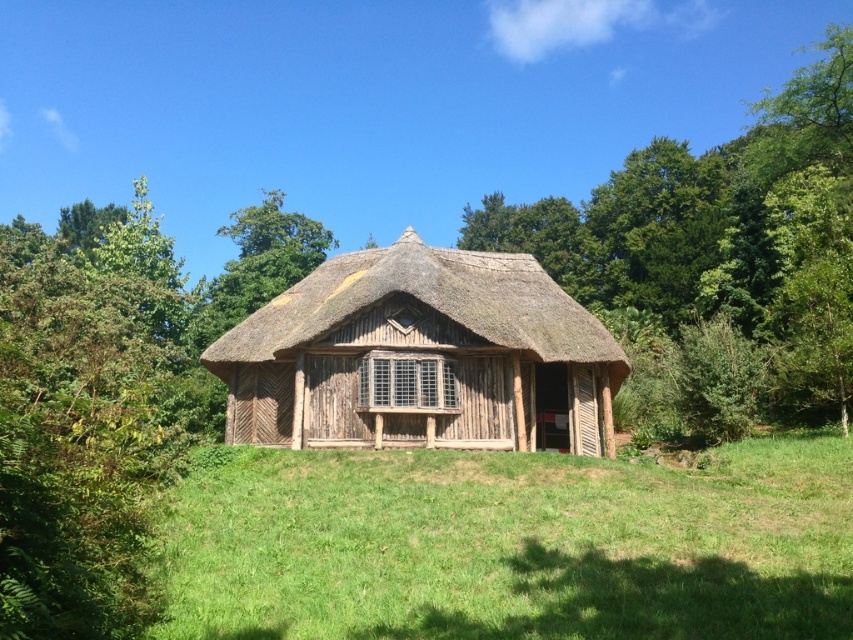
You are standing outside the rustic wooden hut and want to know which is taller between the green grass at center and the thatched straw roof at center. Can you determine this based on the scene?

The green grass at center has a lesser height compared to thatched straw roof at center, so the thatched straw roof at center is taller.

You are standing outside the traditional thatched roof hut and want to place a decorative stone on the ground. If you want the stone to be under the thatched straw roof at center, where should you place it relative to the green grass at center?

You should place the decorative stone on the green grass at center because the green grass at center is below the thatched straw roof at center, meaning it is under the roof.

You are standing at the origin point of the coordinate system in the image. You want to walk to the green grass at center. Which direction should you move in terms of x and y coordinates?

The green grass at center is located at coordinate point x 0.852 and y 0.600, so you should move in the positive x and positive y direction to reach it.